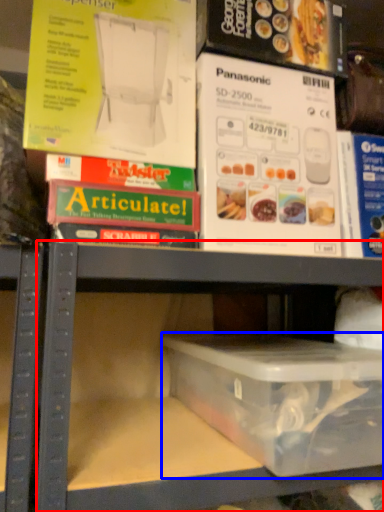
Question: Which point is further to the camera, shelf (highlighted by a red box) or box (highlighted by a blue box)?

Choices:
 (A) shelf
 (B) box

Answer: (B)